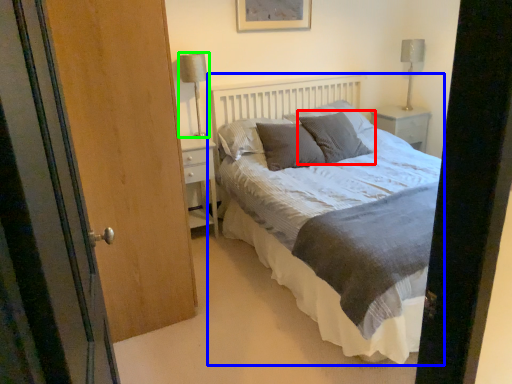
Question: Which is farther away from pillow (highlighted by a red box)? bed (highlighted by a blue box) or table lamp (highlighted by a green box)?

Choices:
 (A) bed
 (B) table lamp

Answer: (B)